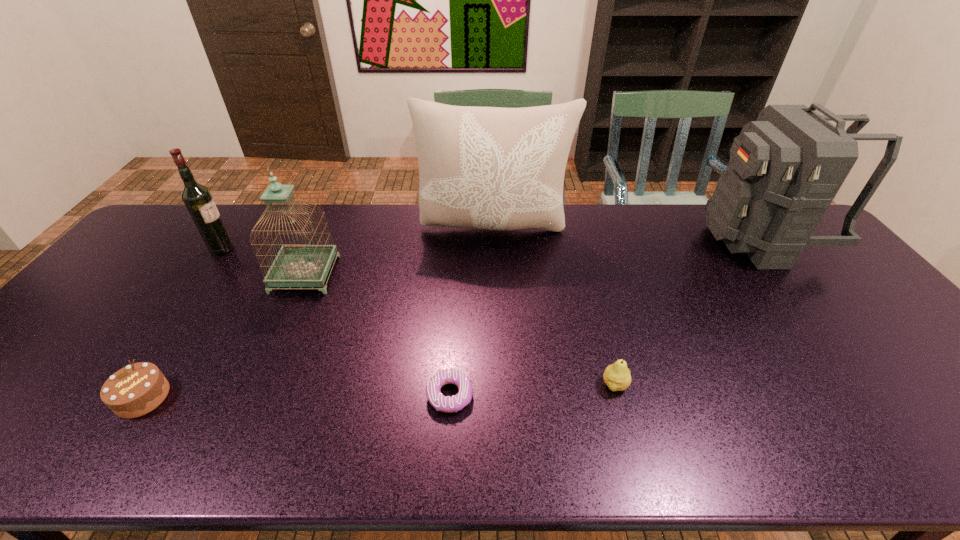
Where is `free location located 0.130m on the front compartment of the rightmost object`? This screenshot has width=960, height=540. free location located 0.130m on the front compartment of the rightmost object is located at coordinates (666, 240).

This screenshot has height=540, width=960. Find the location of `vacant space located 0.060m at the door of the birdcage`. vacant space located 0.060m at the door of the birdcage is located at coordinates (290, 310).

The image size is (960, 540). Identify the location of vacant space located on the front and back of the wine bottle. (312, 249).

At what (x,y) coordinates should I click in order to perform the action: click on free space located 0.100m on the back of the pear. Please return your answer as a coordinate pair (x, y). The image size is (960, 540). Looking at the image, I should click on (603, 341).

Find the location of a particular element. The image size is (960, 540). vacant space situated on the back of the chocolate cake is located at coordinates (181, 338).

Image resolution: width=960 pixels, height=540 pixels. Find the location of `vacant point located 0.090m on the right of the shortest object`. vacant point located 0.090m on the right of the shortest object is located at coordinates (513, 395).

At what (x,y) coordinates should I click in order to perform the action: click on cushion that is at the far edge. Please return your answer as a coordinate pair (x, y). Looking at the image, I should click on (494, 168).

Identify the location of backpack that is at the far edge. Image resolution: width=960 pixels, height=540 pixels. (785, 169).

Find the location of `wine bottle that is at the far edge`. wine bottle that is at the far edge is located at coordinates (197, 198).

The image size is (960, 540). Identify the location of object present at the right edge. (785, 169).